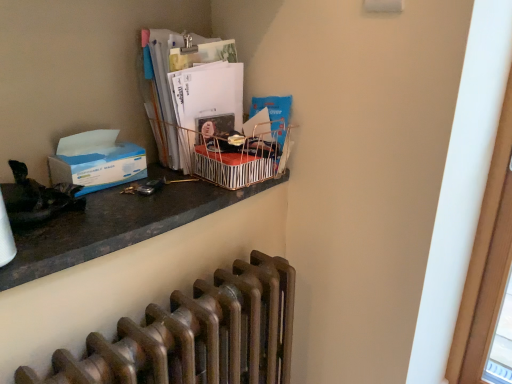
The height and width of the screenshot is (384, 512). Describe the element at coordinates (168, 81) in the screenshot. I see `matte paper magazine at upper center` at that location.

The width and height of the screenshot is (512, 384). What do you see at coordinates (114, 225) in the screenshot?
I see `matte black desk at upper left` at bounding box center [114, 225].

The width and height of the screenshot is (512, 384). Describe the element at coordinates (196, 335) in the screenshot. I see `bronze metallic radiator at lower center` at that location.

Describe the element at coordinates (96, 161) in the screenshot. I see `blue paper at left` at that location.

Locate an element on the screen. This screenshot has height=384, width=512. matte paper magazine at upper center is located at coordinates (168, 81).

Does matte paper magazine at upper center have a smaller size compared to metallic striped basket at upper center?

No, matte paper magazine at upper center is not smaller than metallic striped basket at upper center.

Where is `crate that appears on the right of matte paper magazine at upper center`? The height and width of the screenshot is (384, 512). crate that appears on the right of matte paper magazine at upper center is located at coordinates (233, 168).

Is point (233, 57) closer to viewer compared to point (199, 173)?

No, (233, 57) is further to viewer.

Which object is more forward, matte paper magazine at upper center or metallic striped basket at upper center?

metallic striped basket at upper center is closer to the camera.

Which object is closer to the camera, metallic striped basket at upper center or matte black desk at upper left?

Positioned in front is matte black desk at upper left.

Between metallic striped basket at upper center and matte black desk at upper left, which one has larger size?

matte black desk at upper left.

From the image's perspective, is metallic striped basket at upper center over matte black desk at upper left?

Indeed, from the image's perspective, metallic striped basket at upper center is shown above matte black desk at upper left.

What's the angular difference between metallic striped basket at upper center and matte black desk at upper left's facing directions?

They differ by 0.498 degrees in their facing directions.

Could you tell me if matte paper magazine at upper center is facing matte black desk at upper left?

No, matte paper magazine at upper center is not oriented towards matte black desk at upper left.

Is matte paper magazine at upper center taller than matte black desk at upper left?

Yes.

Does matte paper magazine at upper center come in front of matte black desk at upper left?

No, matte paper magazine at upper center is further to the viewer.

Considering the relative sizes of blue paper at left and matte paper magazine at upper center in the image provided, is blue paper at left taller than matte paper magazine at upper center?

In fact, blue paper at left may be shorter than matte paper magazine at upper center.

Which of these two, blue paper at left or matte paper magazine at upper center, is thinner?

blue paper at left is thinner.

Measure the distance from blue paper at left to matte paper magazine at upper center.

blue paper at left and matte paper magazine at upper center are 7.37 inches apart from each other.

Can you tell me how much matte black desk at upper left and matte paper magazine at upper center differ in facing direction?

The angle between the facing direction of matte black desk at upper left and the facing direction of matte paper magazine at upper center is 0.497 degrees.

Which of these two, matte black desk at upper left or matte paper magazine at upper center, stands taller?

matte paper magazine at upper center is taller.

Who is more distant, matte black desk at upper left or matte paper magazine at upper center?

matte paper magazine at upper center is more distant.

Does matte black desk at upper left turn towards matte paper magazine at upper center?

No.

This screenshot has height=384, width=512. What are the coordinates of `desk on the left of bronze metallic radiator at lower center` in the screenshot? It's located at (114, 225).

Would you say bronze metallic radiator at lower center is a long distance from matte black desk at upper left?

No, there isn't a large distance between bronze metallic radiator at lower center and matte black desk at upper left.

Is bronze metallic radiator at lower center bigger than matte black desk at upper left?

Correct, bronze metallic radiator at lower center is larger in size than matte black desk at upper left.

How much distance is there between bronze metallic radiator at lower center and matte black desk at upper left?

bronze metallic radiator at lower center is 8.84 inches away from matte black desk at upper left.

Is blue paper at left located within matte paper magazine at upper center?

No, blue paper at left is not a part of matte paper magazine at upper center.

Is matte paper magazine at upper center positioned before blue paper at left?

No, it is not.

Is matte paper magazine at upper center beside blue paper at left?

matte paper magazine at upper center and blue paper at left are clearly separated.

Does matte paper magazine at upper center have a greater height compared to blue paper at left?

Yes, matte paper magazine at upper center is taller than blue paper at left.

Find the location of a particular element. Image resolution: width=512 pixels, height=384 pixels. crate on the right of matte paper magazine at upper center is located at coordinates (233, 168).

Locate an element on the screen. This screenshot has width=512, height=384. crate lying behind the matte black desk at upper left is located at coordinates click(x=233, y=168).

Based on their spatial positions, is bronze metallic radiator at lower center or blue paper at left closer to matte paper magazine at upper center?

blue paper at left is closer to matte paper magazine at upper center.

Which object lies nearer to the anchor point metallic striped basket at upper center, matte paper magazine at upper center or bronze metallic radiator at lower center?

matte paper magazine at upper center.

Which object lies nearer to the anchor point blue paper at left, matte paper magazine at upper center or metallic striped basket at upper center?

Based on the image, matte paper magazine at upper center appears to be nearer to blue paper at left.

Considering their positions, is matte black desk at upper left positioned further to matte paper magazine at upper center than metallic striped basket at upper center?

matte black desk at upper left is positioned further to the anchor matte paper magazine at upper center.

Estimate the real-world distances between objects in this image. Which object is further from metallic striped basket at upper center, bronze metallic radiator at lower center or matte paper magazine at upper center?

Among the two, bronze metallic radiator at lower center is located further to metallic striped basket at upper center.

Looking at the image, which one is located closer to bronze metallic radiator at lower center, blue paper at left or metallic striped basket at upper center?

metallic striped basket at upper center.

Based on their spatial positions, is matte paper magazine at upper center or bronze metallic radiator at lower center further from blue paper at left?

bronze metallic radiator at lower center lies further to blue paper at left than the other object.

When comparing their distances from matte paper magazine at upper center, does bronze metallic radiator at lower center or matte black desk at upper left seem closer?

matte black desk at upper left lies closer to matte paper magazine at upper center than the other object.

The image size is (512, 384). What are the coordinates of `desk that lies between blue paper at left and bronze metallic radiator at lower center from top to bottom` in the screenshot? It's located at (114, 225).

Locate an element on the screen. The height and width of the screenshot is (384, 512). crate that lies between matte paper magazine at upper center and bronze metallic radiator at lower center from top to bottom is located at coordinates (233, 168).

This screenshot has width=512, height=384. Identify the location of box between matte paper magazine at upper center and bronze metallic radiator at lower center vertically. (96, 161).

What are the coordinates of `box between metallic striped basket at upper center and bronze metallic radiator at lower center in the vertical direction` in the screenshot? It's located at (96, 161).